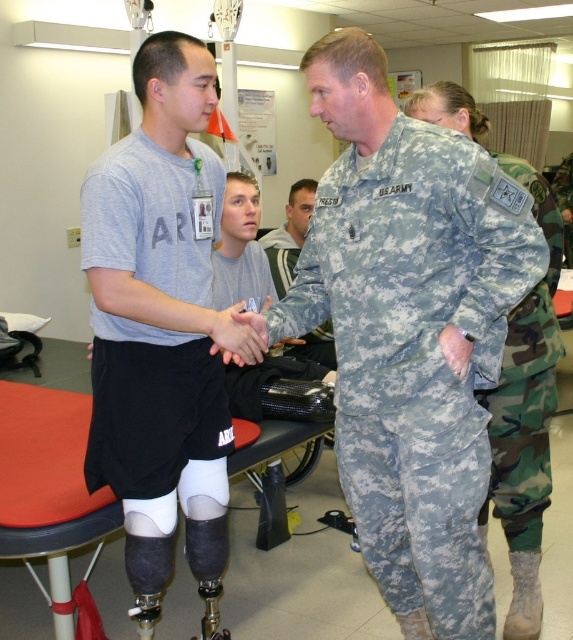
Question: Is camouflage fabric uniform at center behind camouflage uniform at center?

Choices:
 (A) no
 (B) yes

Answer: (A)

Question: Which of the following is the closest to the observer?

Choices:
 (A) (292, 230)
 (B) (406, 525)
 (C) (503, 444)
 (D) (101, 387)

Answer: (B)

Question: Among these points, which one is farthest from the camera?

Choices:
 (A) (539, 182)
 (B) (121, 358)
 (C) (312, 196)

Answer: (C)

Question: Which point appears closest to the camera in this image?

Choices:
 (A) (129, 170)
 (B) (296, 244)
 (C) (555, 253)

Answer: (A)

Question: Is camouflage fabric uniform at center to the right of gray matte t-shirt at center from the viewer's perspective?

Choices:
 (A) yes
 (B) no

Answer: (A)

Question: Does gray matte t-shirt at center have a smaller size compared to camouflage uniform at center?

Choices:
 (A) no
 (B) yes

Answer: (A)